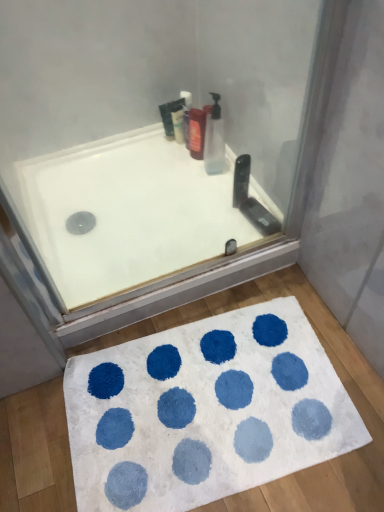
Where is `free point below white shaggy bath mat at lower center (from a real-world perspective)`? free point below white shaggy bath mat at lower center (from a real-world perspective) is located at coordinates (205, 405).